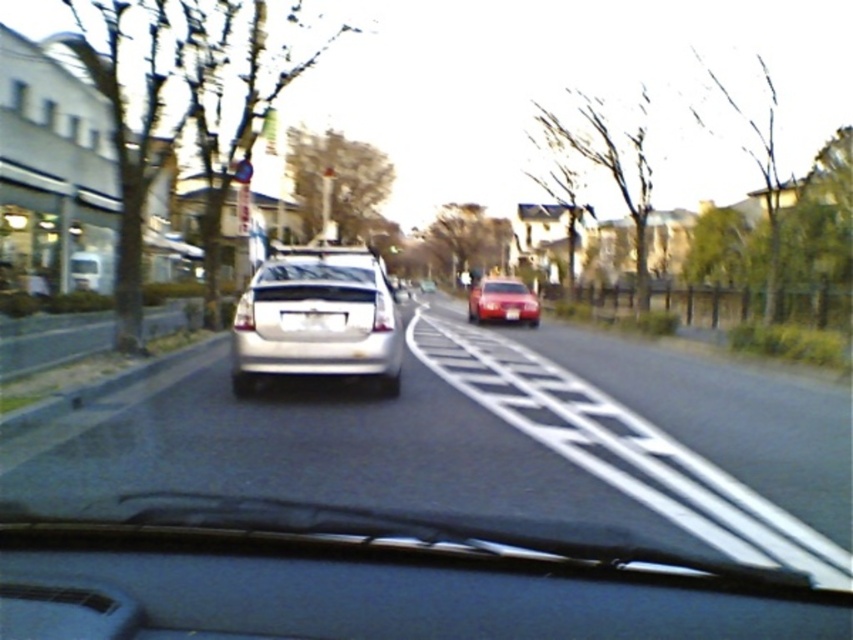
You are driving a car and see a satin silver sedan at center and a shiny red car at center on the road ahead. Which car takes up less space horizontally from your viewpoint?

The satin silver sedan at center has a lesser width compared to the shiny red car at center, so it takes up less horizontal space in your view.

You are driving a car and need to make a U turn. There is a satin silver sedan at center in front of you. According to the road rules, can you safely make a U turn here?

No, you cannot safely make a U turn here because there is a satin silver sedan at center directly in front of you, blocking the path.

You are driving and looking through the windshield. There are two points marked on the road ahead, point (376, 260) and point (514, 307). Which point is closer to your car?

Point (376, 260) is closer to the camera than point (514, 307).